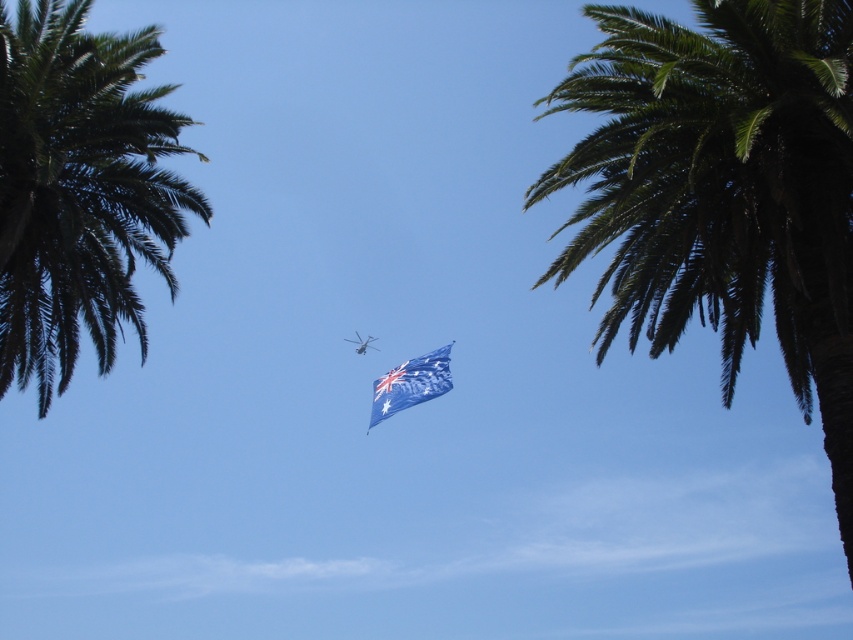
Question: Among these objects, which one is farthest from the camera?

Choices:
 (A) blue fabric flag at center
 (B) green leafy palm tree at left
 (C) metallic silver helicopter at center
 (D) green leafy palm tree at upper right

Answer: (C)

Question: Among these points, which one is farthest from the camera?

Choices:
 (A) click(45, 154)
 (B) click(433, 376)
 (C) click(364, 337)

Answer: (C)

Question: Among these objects, which one is nearest to the camera?

Choices:
 (A) green leafy palm tree at upper right
 (B) metallic silver helicopter at center
 (C) green leafy palm tree at left
 (D) blue fabric flag at center

Answer: (A)

Question: Is green leafy palm tree at left to the right of metallic silver helicopter at center from the viewer's perspective?

Choices:
 (A) yes
 (B) no

Answer: (B)

Question: Is green leafy palm tree at upper right below green leafy palm tree at left?

Choices:
 (A) no
 (B) yes

Answer: (A)

Question: Is green leafy palm tree at upper right wider than green leafy palm tree at left?

Choices:
 (A) no
 (B) yes

Answer: (B)